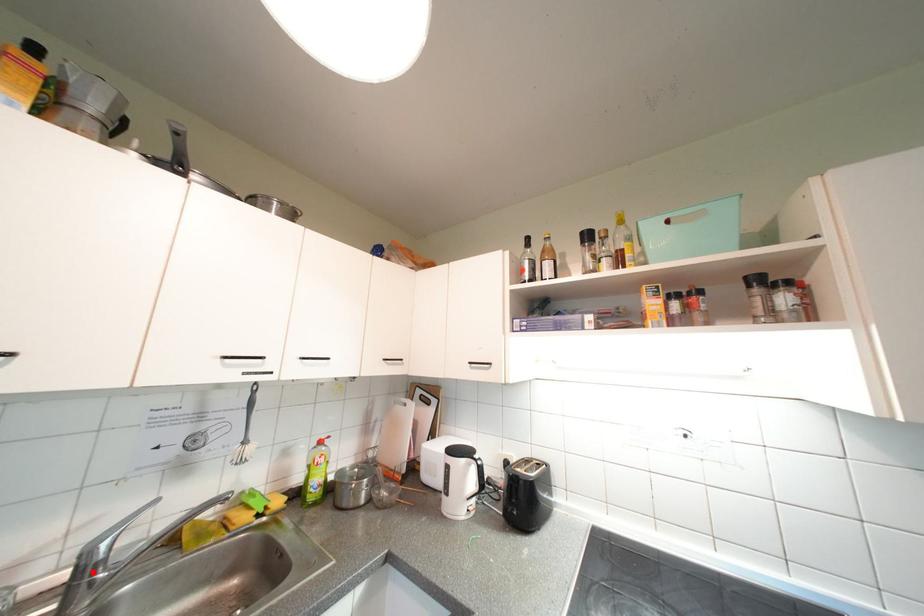
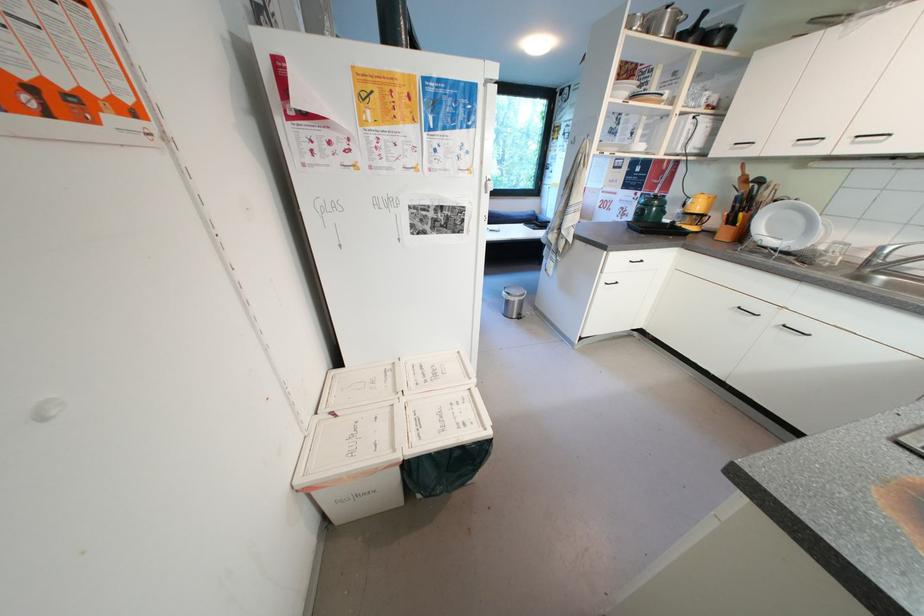
The point at the highlighted location is marked in the first image. Where is the corresponding point in the second image?

(883, 257)